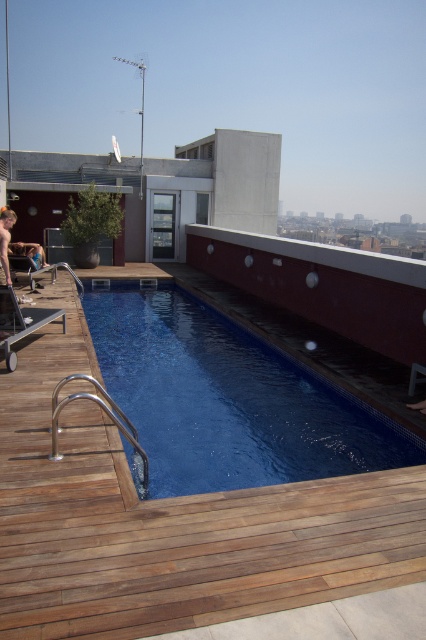
Question: Does wooden deck at center have a lesser width compared to silver metallic rail at lower left?

Choices:
 (A) no
 (B) yes

Answer: (A)

Question: Based on their relative distances, which object is nearer to the blue tile swimming pool at center?

Choices:
 (A) silver metallic rail at lower left
 (B) wooden deck at center

Answer: (A)

Question: Estimate the real-world distances between objects in this image. Which object is farther from the blue tile swimming pool at center?

Choices:
 (A) silver metallic rail at lower left
 (B) wooden deck at center

Answer: (B)

Question: Can you confirm if blue tile swimming pool at center is positioned to the right of silver metallic rail at lower left?

Choices:
 (A) yes
 (B) no

Answer: (A)

Question: Which object is positioned closest to the wooden deck at center?

Choices:
 (A) silver metallic rail at lower left
 (B) blue tile swimming pool at center

Answer: (A)

Question: Is wooden deck at center below silver metallic rail at lower left?

Choices:
 (A) no
 (B) yes

Answer: (B)